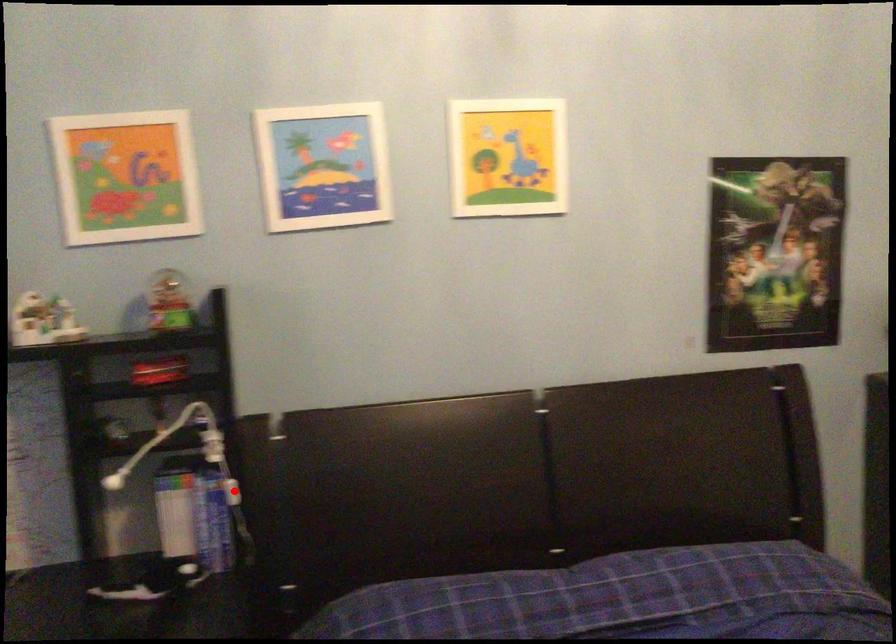
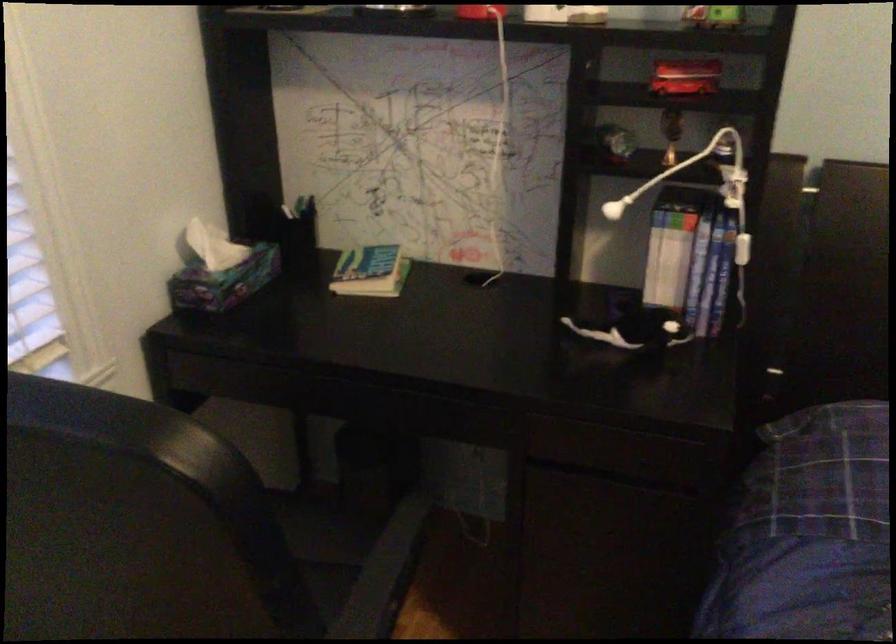
Question: I am providing you with two images of the same scene from different viewpoints. A red point is shown in image1. For the corresponding object point in image2, is it positioned nearer or farther from the camera?

Choices:
 (A) Nearer
 (B) Farther

Answer: (A)